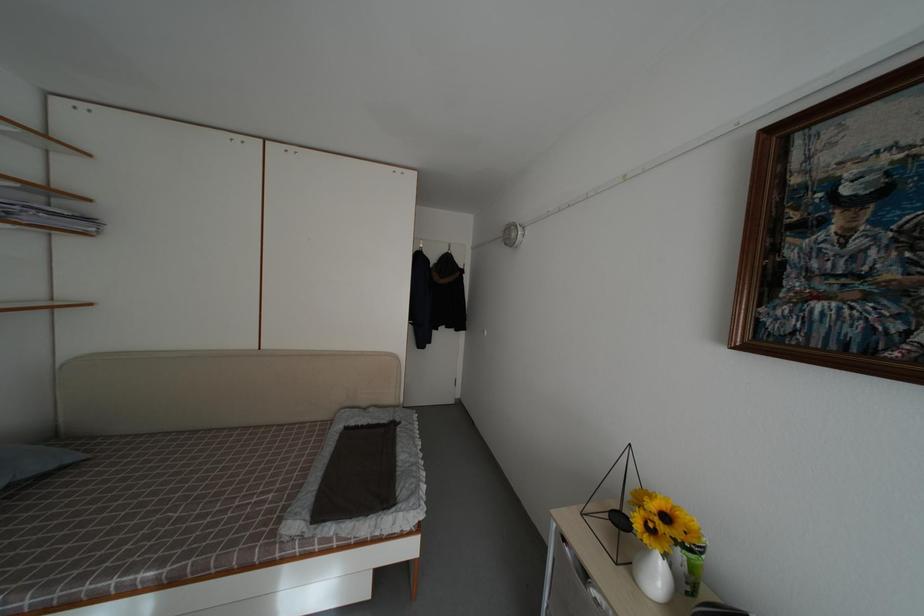
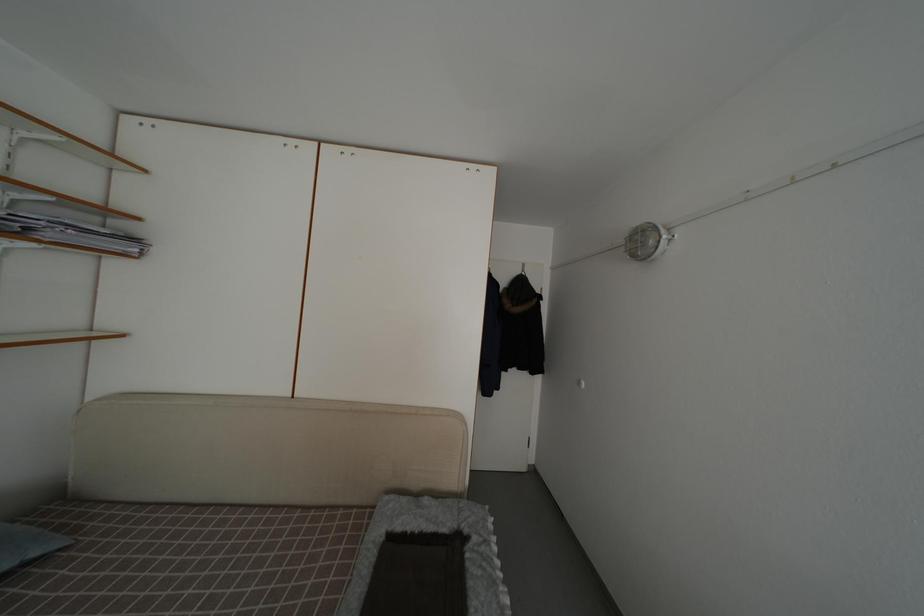
Question: The camera is either moving clockwise (left) or counter-clockwise (right) around the object. The first image is from the beginning of the video and the second image is from the end. Is the camera moving left or right when shooting the video?

Choices:
 (A) Left
 (B) Right

Answer: (B)